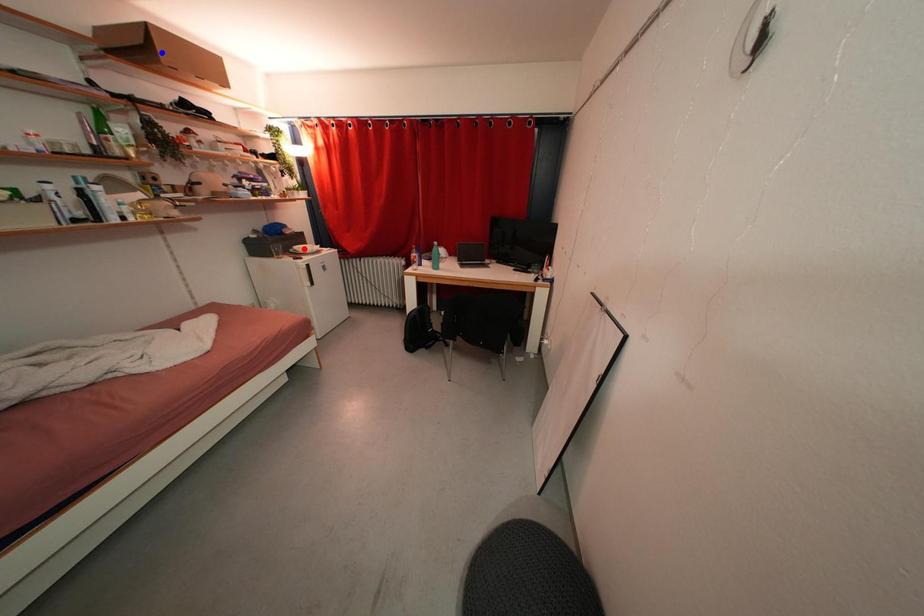
Question: In the image, two points are highlighted. Which point is nearer to the camera? Reply with the corresponding letter.

Choices:
 (A) blue point
 (B) red point

Answer: (A)